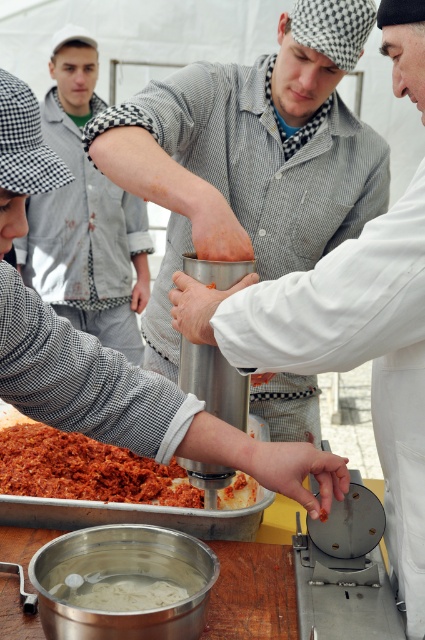
You are a photographer at the event and want to capture a photo of both the matte gray shirt at center and the checkered fabric shirt at upper left. Which shirt should you focus on first if you want to include both in the frame without moving the camera?

You should focus on the checkered fabric shirt at upper left first because the matte gray shirt at center is positioned to its right side, so capturing the leftmost shirt first ensures both are in frame.

You are standing at the center of the image. Where is the checkered fabric shirt at upper left located relative to your position?

The checkered fabric shirt at upper left is located at the upper left direction from your position at the center of the image.